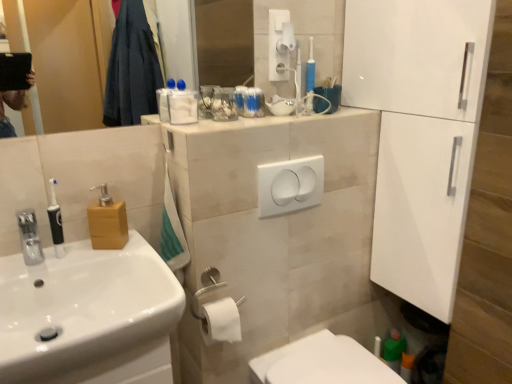
At what (x,y) coordinates should I click in order to perform the action: click on free space above white glossy toilet at lower center (from a real-world perspective). Please return your answer as a coordinate pair (x, y). Image resolution: width=512 pixels, height=384 pixels. Looking at the image, I should click on (313, 358).